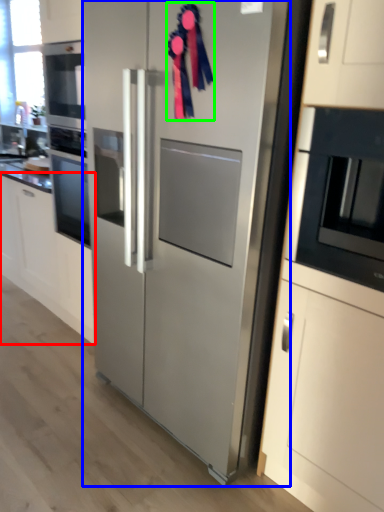
Question: Which object is the closest to the cabinetry (highlighted by a red box)? Choose among these: refrigerator (highlighted by a blue box) or ribbon (highlighted by a green box).

Choices:
 (A) refrigerator
 (B) ribbon

Answer: (A)